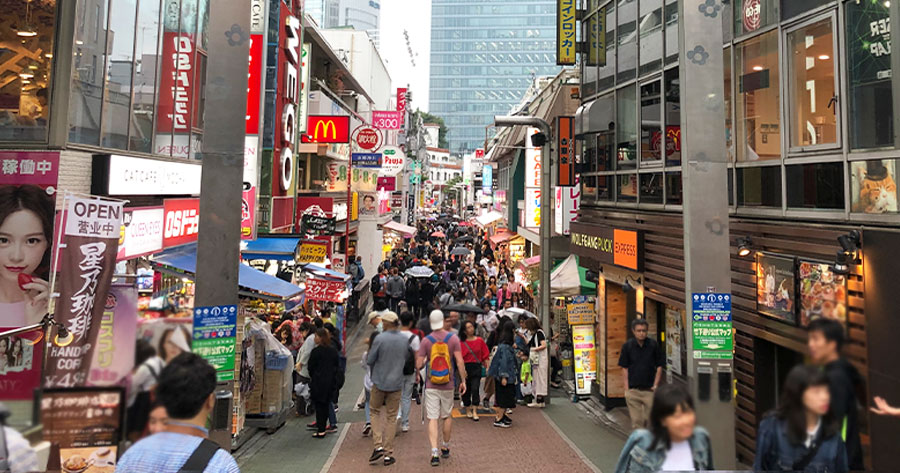
Locate an element on the screen. glass is located at coordinates (646, 99).